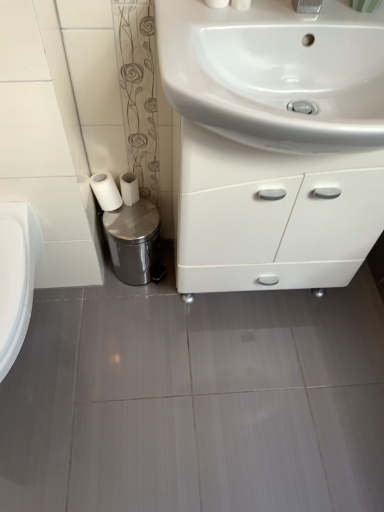
Question: Is point (99, 190) positioned closer to the camera than point (185, 195)?

Choices:
 (A) farther
 (B) closer

Answer: (A)

Question: From a real-world perspective, is white matte toilet paper at lower left, the second toilet paper from the right, positioned above or below white glossy cabinet at center?

Choices:
 (A) above
 (B) below

Answer: (B)

Question: Estimate the real-world distances between objects in this image. Which object is farther from the white matte toilet paper at lower left, the second toilet paper from the right?

Choices:
 (A) white glossy sink at upper center
 (B) white glossy cabinet at center
 (C) shiny metallic trash can at lower left
 (D) white matte toilet paper at lower left, the second toilet paper in the left-to-right sequence

Answer: (A)

Question: Which object is positioned farthest from the white glossy cabinet at center?

Choices:
 (A) white matte toilet paper at lower left, which ranks as the first toilet paper in left-to-right order
 (B) white matte toilet paper at lower left, positioned as the first toilet paper in right-to-left order
 (C) white glossy sink at upper center
 (D) shiny metallic trash can at lower left

Answer: (A)